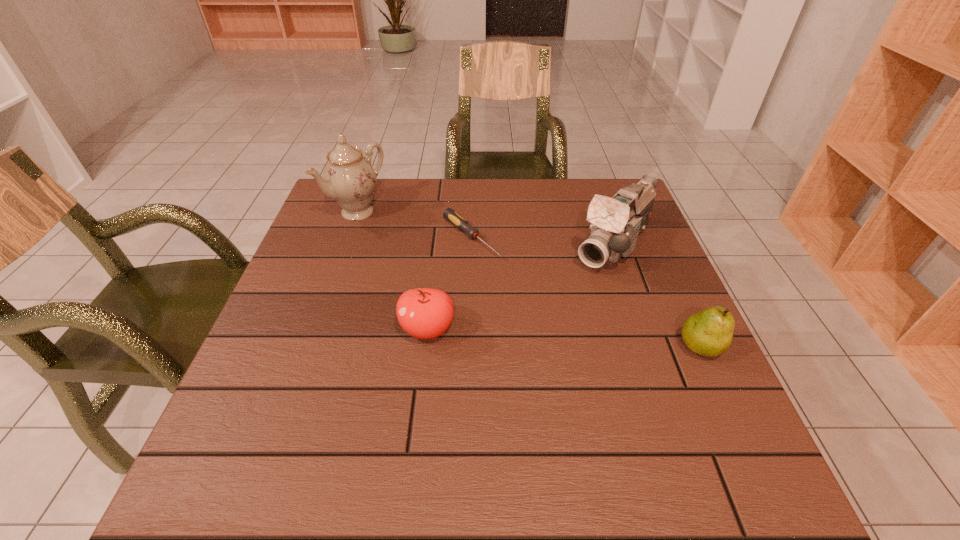
Find the location of a particular element. apple is located at coordinates (425, 313).

I want to click on pear, so (x=709, y=332).

Locate an element on the screen. This screenshot has height=540, width=960. the shortest object is located at coordinates (458, 221).

Locate an element on the screen. The width and height of the screenshot is (960, 540). the leftmost object is located at coordinates (349, 178).

The width and height of the screenshot is (960, 540). In order to click on chinaware in this screenshot , I will do `click(349, 178)`.

You are a GUI agent. You are given a task and a screenshot of the screen. Output one action in this format:
    pyautogui.click(x=<x>, y=<y>)
    Task: Click on the second tallest object
    
    Given the screenshot: What is the action you would take?
    pyautogui.click(x=617, y=222)

This screenshot has height=540, width=960. Identify the location of free space located on the back of the apple. (436, 260).

The height and width of the screenshot is (540, 960). What are the coordinates of `vacant space located 0.120m on the left of the pear` in the screenshot? It's located at (619, 347).

This screenshot has width=960, height=540. I want to click on free space located 0.130m insert the shortest object into a screw head, so click(524, 285).

Locate an element on the screen. vacant space located insert the shortest object into a screw head is located at coordinates (507, 271).